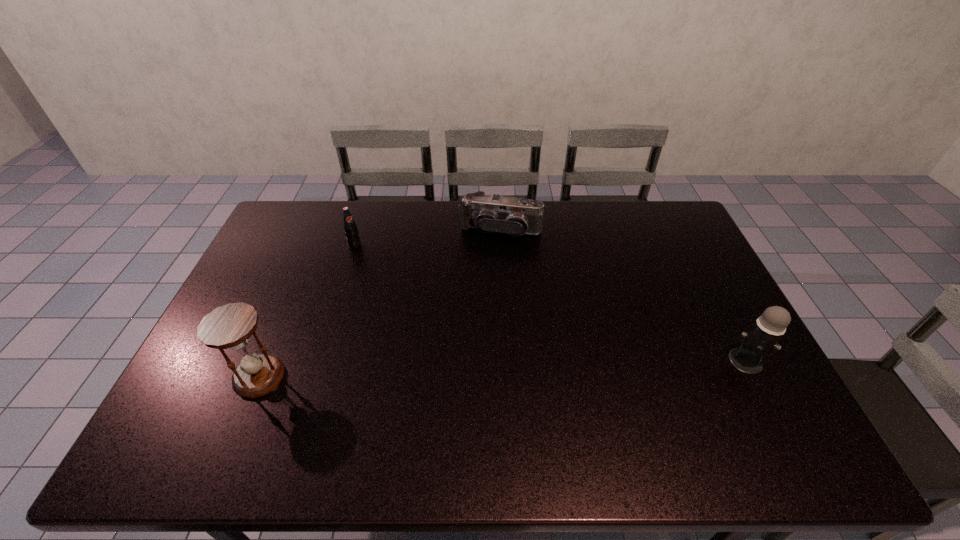
At what (x,y) coordinates should I click in order to perform the action: click on free spot located 0.080m on the front label of the second object from left to right. Please return your answer as a coordinate pair (x, y). Looking at the image, I should click on (370, 260).

Locate an element on the screen. Image resolution: width=960 pixels, height=540 pixels. free space located on the front label of the second object from left to right is located at coordinates (384, 274).

Locate an element on the screen. This screenshot has height=540, width=960. object present at the far edge is located at coordinates (488, 213).

Identify the location of object at the near edge. (230, 326).

Find the location of `object located in the left edge section of the desktop`. object located in the left edge section of the desktop is located at coordinates (230, 326).

Identify the location of object that is at the right edge. (762, 339).

Find the location of a particular element. object that is positioned at the near left corner is located at coordinates (230, 326).

Identify the location of free space at the far edge. This screenshot has width=960, height=540. (331, 228).

Where is `vacant space at the left edge of the desktop`? vacant space at the left edge of the desktop is located at coordinates (251, 305).

Where is `vacant region at the near left corner of the desktop`? This screenshot has height=540, width=960. vacant region at the near left corner of the desktop is located at coordinates (240, 402).